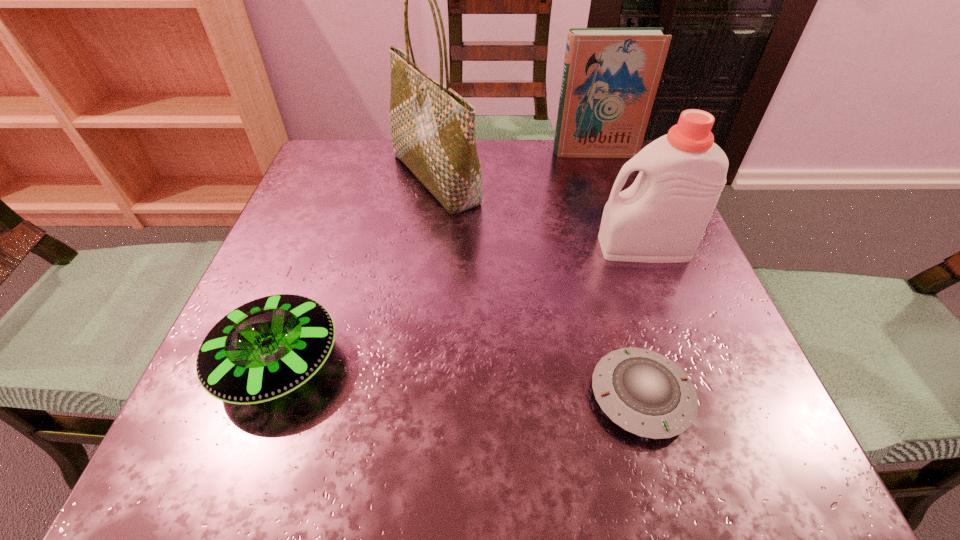
Where is `the fourth object from right to left`? the fourth object from right to left is located at coordinates (432, 127).

The width and height of the screenshot is (960, 540). I want to click on shopping bag, so click(x=432, y=127).

You are a GUI agent. You are given a task and a screenshot of the screen. Output one action in this format:
    pyautogui.click(x=<x>, y=<y>)
    Task: Click on the hardback book
    Image resolution: width=960 pixels, height=540 pixels.
    Given the screenshot: What is the action you would take?
    pyautogui.click(x=610, y=77)

This screenshot has height=540, width=960. Find the location of `the third nearest object`. the third nearest object is located at coordinates (661, 218).

The image size is (960, 540). Identify the location of the taller saucer. (265, 349).

Where is `the left saucer`? This screenshot has width=960, height=540. the left saucer is located at coordinates (265, 349).

You are a GUI agent. You are given a task and a screenshot of the screen. Output one action in this format:
    pyautogui.click(x=<x>, y=<y>)
    Task: Click on the shorter saucer
    
    Given the screenshot: What is the action you would take?
    pyautogui.click(x=643, y=392)

Where is `the shortest object`? The width and height of the screenshot is (960, 540). the shortest object is located at coordinates [x=643, y=392].

Identify the location of blank space located 0.210m on the front of the tallest object. This screenshot has width=960, height=540. [x=420, y=305].

I want to click on blank space located 0.060m on the cover of the hardback book, so (x=602, y=173).